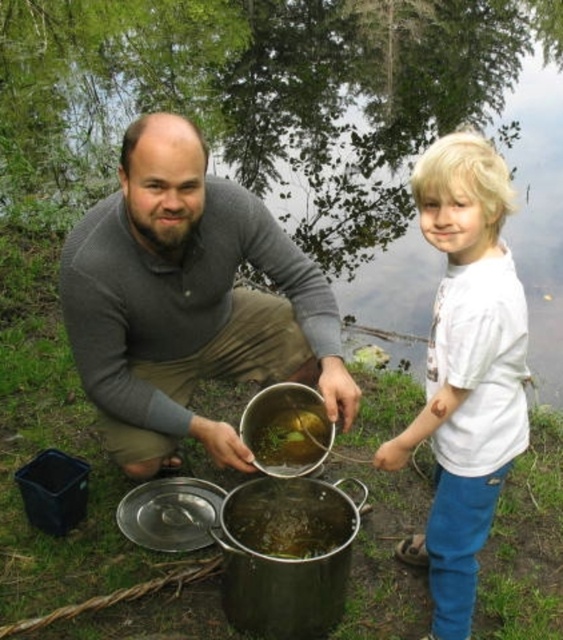
You are standing at the camera position and want to hand the matte gray sweater at center to someone who is 10 feet away from you. Can you reach them without moving?

The matte gray sweater at center is 7.33 feet away from the camera, so you can reach them since the distance is less than 10 feet.

You are a photographer trying to capture a closeup of the slightly browned metal pot at center without including the matte gray sweater at center in the frame. Based on their sizes, is this possible?

The matte gray sweater at center might be wider than slightly browned metal pot at center, so there is a possibility that the sweater is wider. Therefore, it might be challenging to capture the pot without including the sweater if the sweater is indeed wider. Adjust your angle or zoom accordingly.